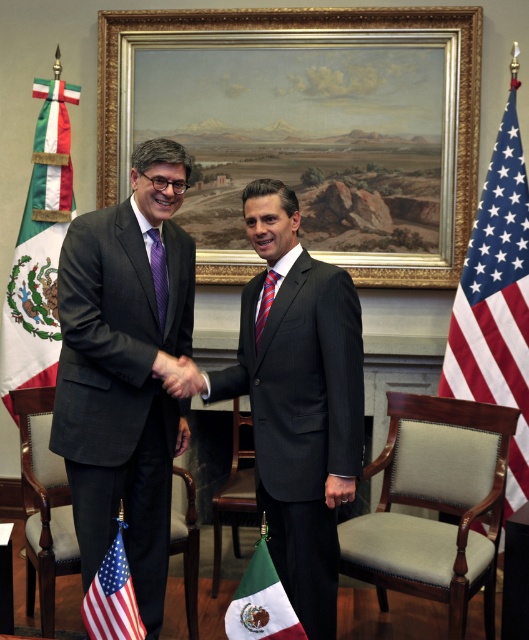
You are a photographer trying to capture a closeup of the dark gray suit at center and the smooth skin handshake at center. Which object is wider in the image?

The dark gray suit at center might be wider than smooth skin handshake at center according to the description.

You are a photographer setting up for a formal event. You need to ensure that the matte black suit at center and the american flag at lower left are both visible in your photo. Given their sizes, which object should you focus on to ensure both are in frame without cropping?

The matte black suit at center is much taller than the american flag at lower left, so focusing on the taller matte black suit at center will ensure both are visible without cropping.